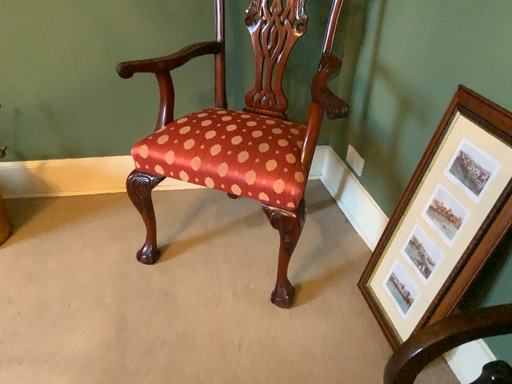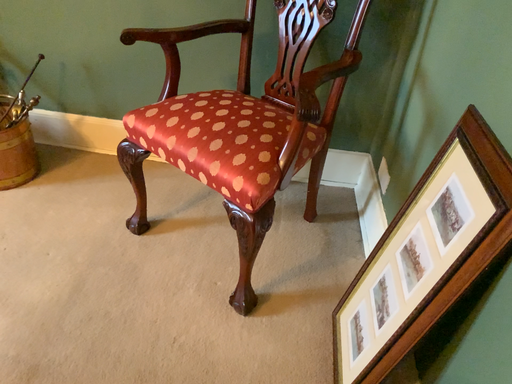
Question: Which way did the camera rotate in the video?

Choices:
 (A) rotated left
 (B) rotated right

Answer: (A)